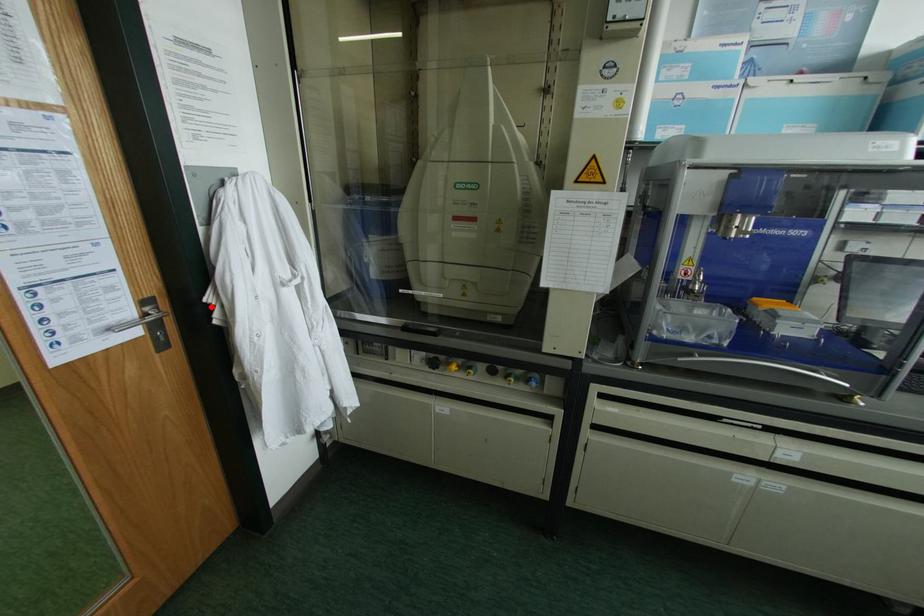
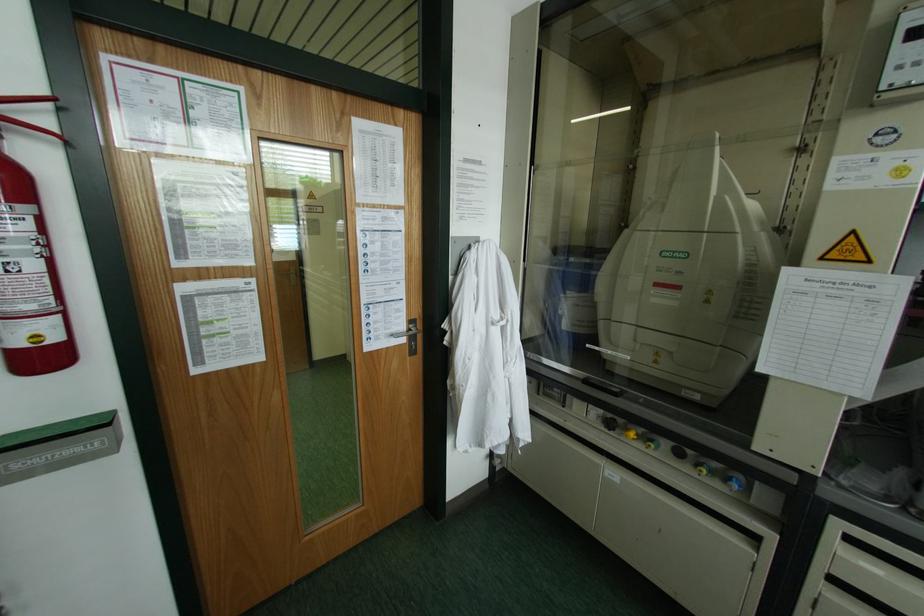
Locate, in the second image, the point that corresponds to the highlighted location in the first image.

(444, 331)